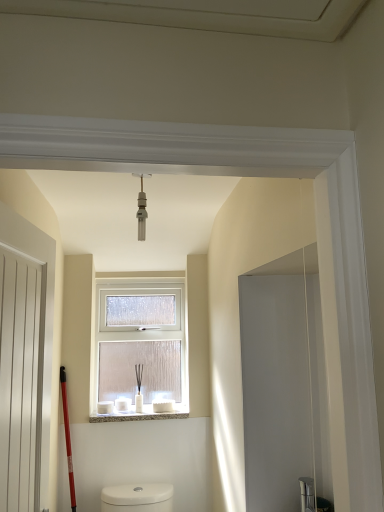
Question: Considering the relative sizes of white wooden screen door at left and white textured stone at center in the image provided, is white wooden screen door at left bigger than white textured stone at center?

Choices:
 (A) no
 (B) yes

Answer: (B)

Question: Considering the relative sizes of white wooden screen door at left and white textured stone at center in the image provided, is white wooden screen door at left smaller than white textured stone at center?

Choices:
 (A) no
 (B) yes

Answer: (A)

Question: Is white wooden screen door at left to the left of white textured stone at center from the viewer's perspective?

Choices:
 (A) no
 (B) yes

Answer: (B)

Question: Is white wooden screen door at left looking in the opposite direction of white textured stone at center?

Choices:
 (A) no
 (B) yes

Answer: (A)

Question: Is white wooden screen door at left closer to camera compared to white textured stone at center?

Choices:
 (A) no
 (B) yes

Answer: (B)

Question: Could white textured stone at center be considered to be inside white wooden screen door at left?

Choices:
 (A) yes
 (B) no

Answer: (B)

Question: Considering the relative positions of clear frosted glass window at center and white wooden screen door at left in the image provided, is clear frosted glass window at center to the left of white wooden screen door at left from the viewer's perspective?

Choices:
 (A) yes
 (B) no

Answer: (B)

Question: From a real-world perspective, is clear frosted glass window at center over white wooden screen door at left?

Choices:
 (A) no
 (B) yes

Answer: (B)

Question: Could you tell me if clear frosted glass window at center is turned towards white wooden screen door at left?

Choices:
 (A) no
 (B) yes

Answer: (B)

Question: From a real-world perspective, is clear frosted glass window at center below white wooden screen door at left?

Choices:
 (A) yes
 (B) no

Answer: (B)

Question: Considering the relative sizes of clear frosted glass window at center and white wooden screen door at left in the image provided, is clear frosted glass window at center shorter than white wooden screen door at left?

Choices:
 (A) yes
 (B) no

Answer: (A)

Question: Can you confirm if clear frosted glass window at center is thinner than white wooden screen door at left?

Choices:
 (A) yes
 (B) no

Answer: (B)

Question: Is white wooden screen door at left closer to the viewer compared to matte silver light fixture at center?

Choices:
 (A) no
 (B) yes

Answer: (B)